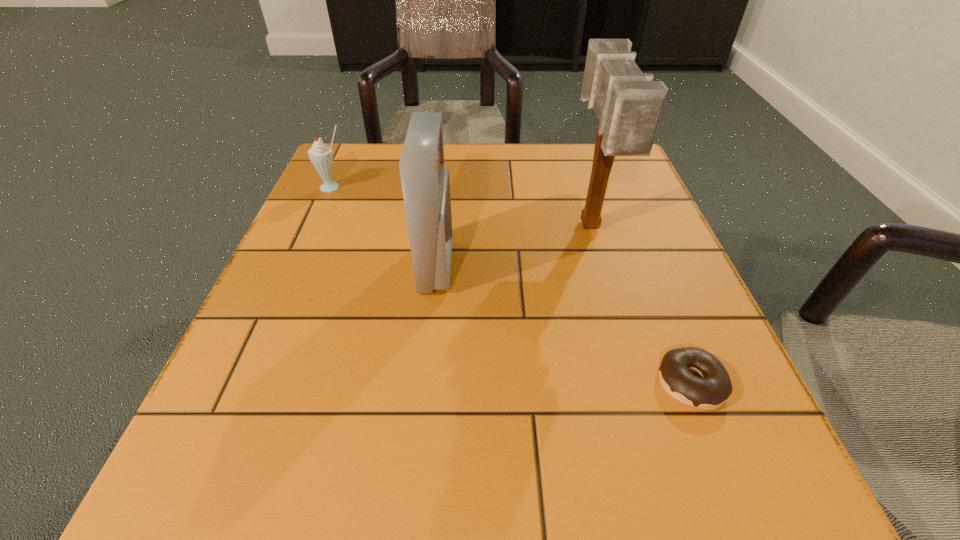
What are the coordinates of `mallet` in the screenshot? It's located at (628, 104).

Identify the location of the third shortest object. (425, 183).

Where is `the first-aid kit`? Image resolution: width=960 pixels, height=540 pixels. the first-aid kit is located at coordinates (425, 183).

You are a GUI agent. You are given a task and a screenshot of the screen. Output one action in this format:
    pyautogui.click(x=<x>, y=<y>)
    Task: Click on the third tallest object
    
    Given the screenshot: What is the action you would take?
    pyautogui.click(x=321, y=155)

Find the location of `milkshake`. milkshake is located at coordinates (321, 155).

Where is `doughnut`? The width and height of the screenshot is (960, 540). doughnut is located at coordinates (714, 388).

Find the location of a particular element. the nearest object is located at coordinates (714, 388).

Where is `free space located on the left of the tallest object`? free space located on the left of the tallest object is located at coordinates (526, 227).

Where is `vacant space located on the front-facing side of the second object from left to right`? vacant space located on the front-facing side of the second object from left to right is located at coordinates (565, 266).

Find the location of a particular element. vacant point located 0.120m on the straw side of the leftmost object is located at coordinates (316, 228).